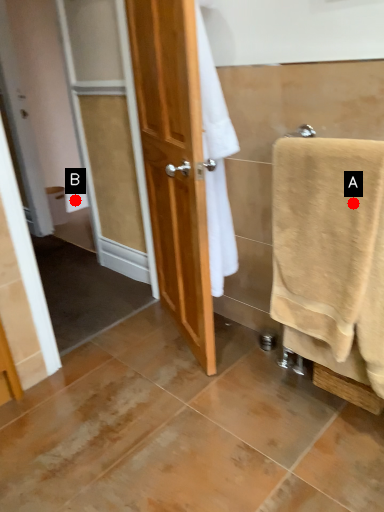
Question: Two points are circled on the image, labeled by A and B beside each circle. Among these points, which one is farthest from the camera?

Choices:
 (A) A is further
 (B) B is further

Answer: (B)